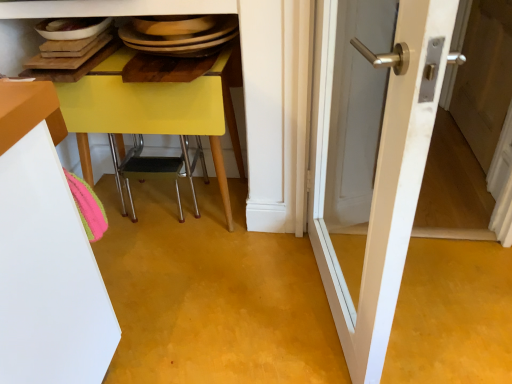
The height and width of the screenshot is (384, 512). In order to click on free space in front of yellow plastic chair at lower center in this screenshot , I will do `click(192, 276)`.